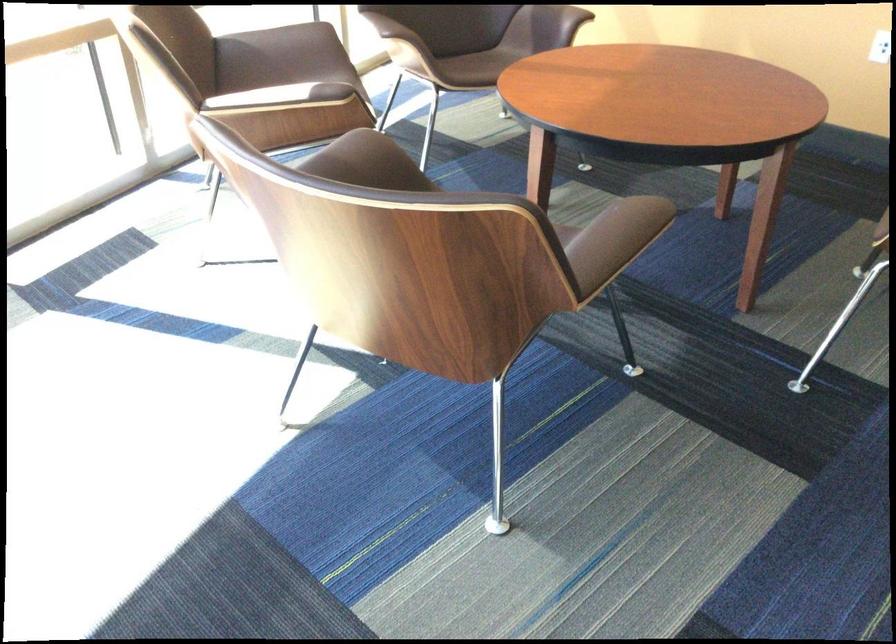
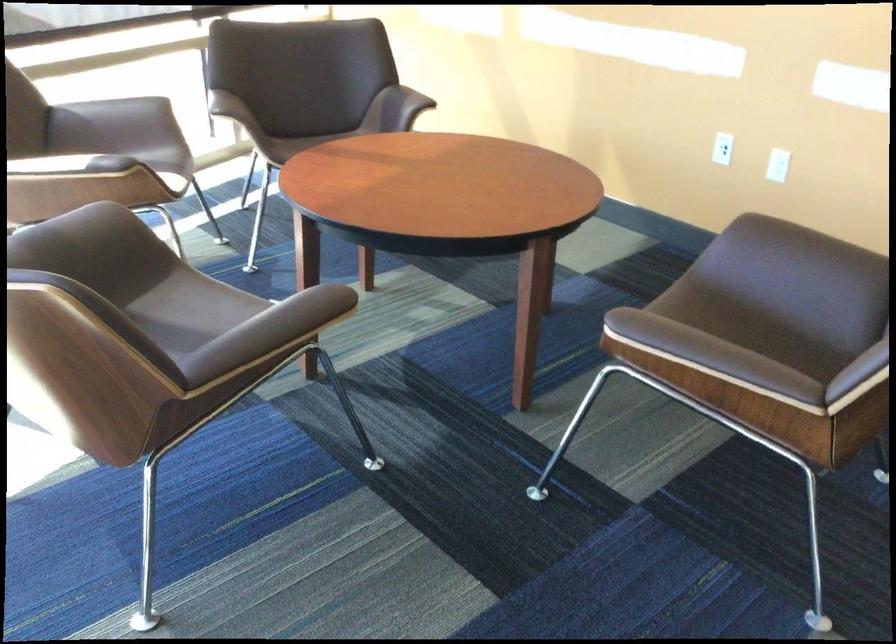
The point at [349,158] is marked in the first image. Where is the corresponding point in the second image?

(76, 232)